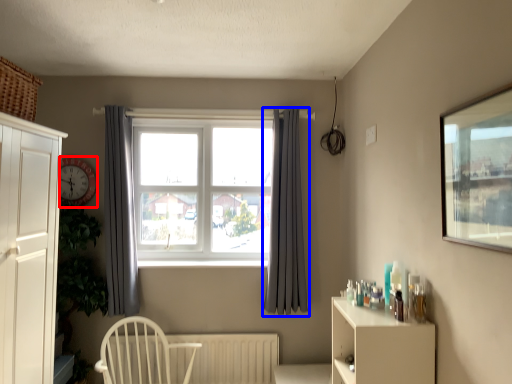
Question: Which point is further to the camera, clock (highlighted by a red box) or curtain (highlighted by a blue box)?

Choices:
 (A) clock
 (B) curtain

Answer: (A)